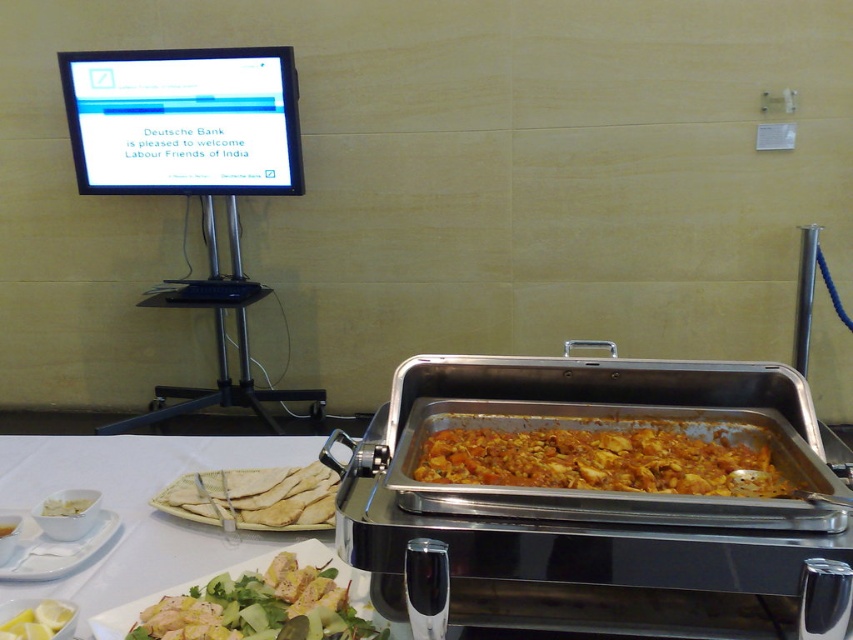
Who is shorter, white matte platter at lower left or yellow matte lemon at lower left?

With less height is yellow matte lemon at lower left.

Is point (0, 564) farther from viewer compared to point (16, 618)?

Yes, point (0, 564) is behind point (16, 618).

Where is `white matte platter at lower left`? The height and width of the screenshot is (640, 853). white matte platter at lower left is located at coordinates (54, 548).

Can you confirm if orange-brown textured chicken at center is positioned above white matte platter at lower left?

Yes.

Describe the element at coordinates (601, 460) in the screenshot. This screenshot has width=853, height=640. I see `orange-brown textured chicken at center` at that location.

The image size is (853, 640). In order to click on orange-brown textured chicken at center in this screenshot , I will do `click(601, 460)`.

Can you confirm if yellowish glossy chicken salad at lower center is positioned to the right of yellow matte lemon at lower left?

Indeed, yellowish glossy chicken salad at lower center is positioned on the right side of yellow matte lemon at lower left.

Does point (334, 621) come behind point (28, 627)?

Yes, point (334, 621) is behind point (28, 627).

Locate an element on the screen. yellowish glossy chicken salad at lower center is located at coordinates (259, 608).